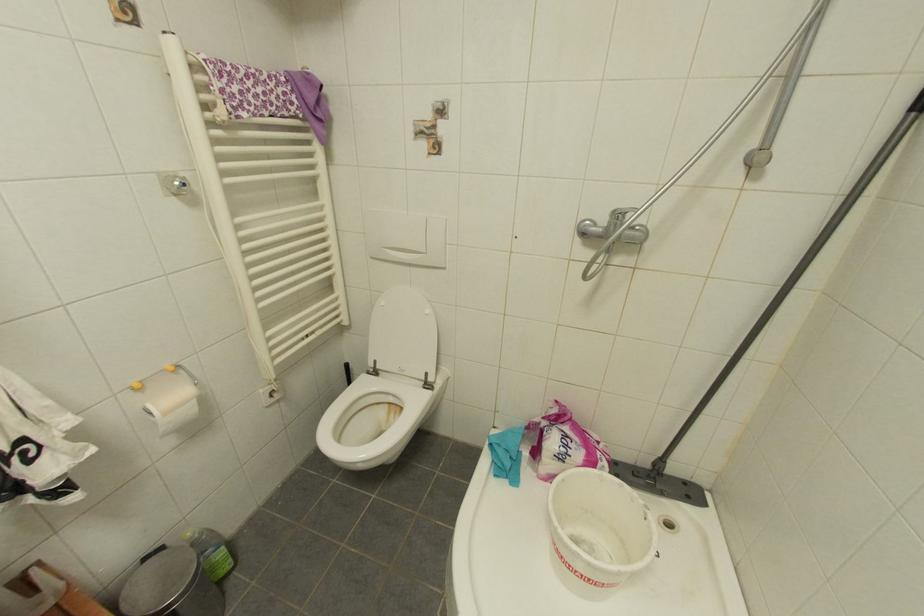
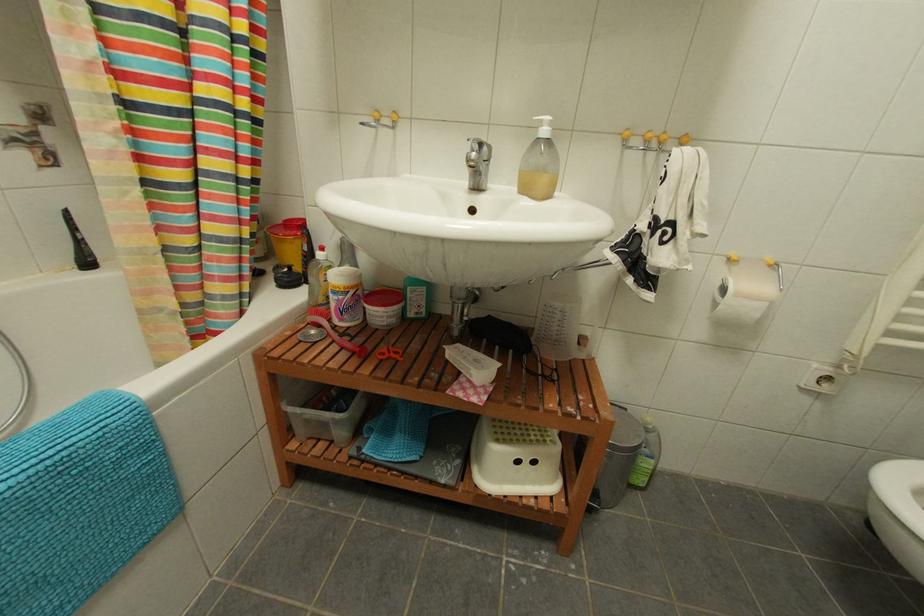
Consider the image. The images are taken continuously from a first-person perspective. In which direction is your viewpoint rotating?

The camera rotated toward left-down.